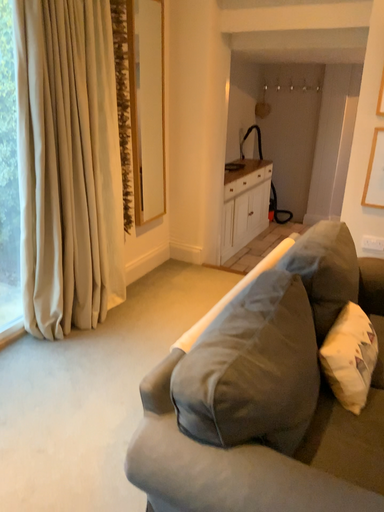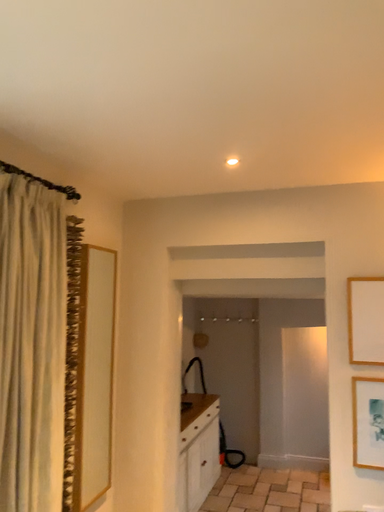
Question: How did the camera likely rotate when shooting the video?

Choices:
 (A) rotated right
 (B) rotated left

Answer: (A)